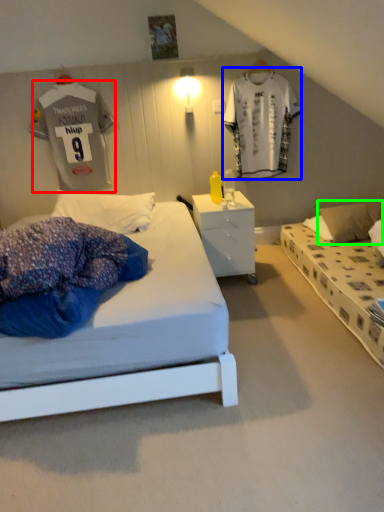
Question: Estimate the real-world distances between objects in this image. Which object is closer to t shirt (highlighted by a red box), t shirt (highlighted by a blue box) or pillow (highlighted by a green box)?

Choices:
 (A) t shirt
 (B) pillow

Answer: (A)